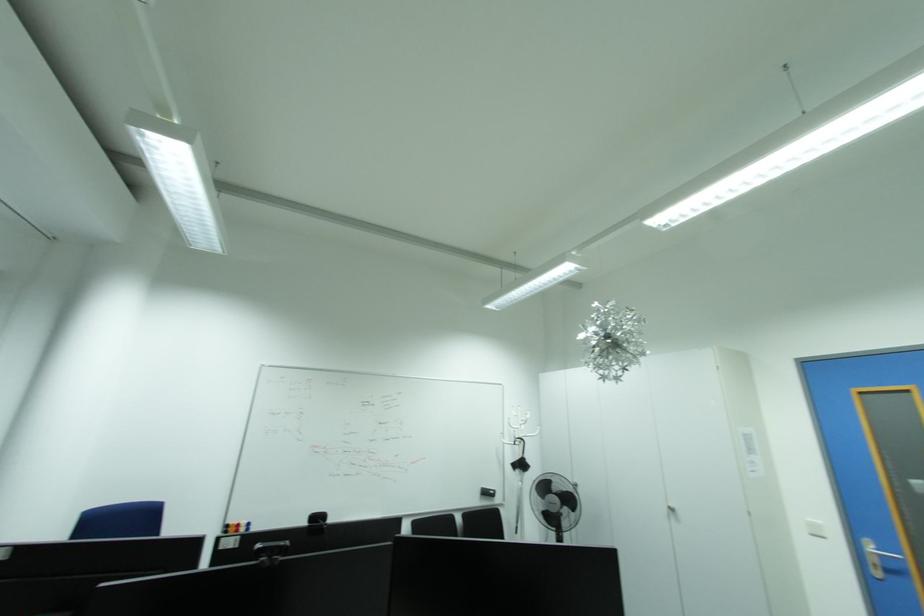
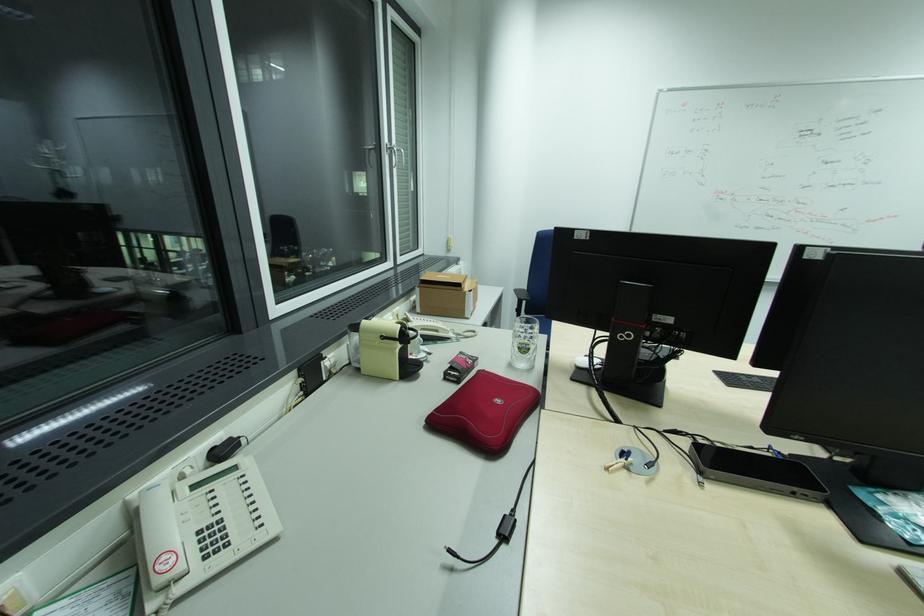
Based on the photo, based on the continuous images, in which direction is the camera rotating?

The camera rotated toward left-down.